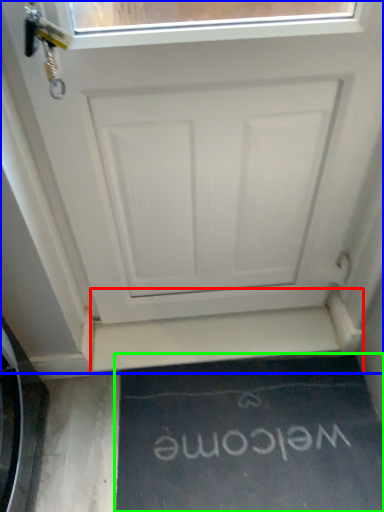
Question: Considering the real-world distances, which object is farthest from stairwell (highlighted by a red box)? door (highlighted by a blue box) or doormat (highlighted by a green box)?

Choices:
 (A) door
 (B) doormat

Answer: (A)